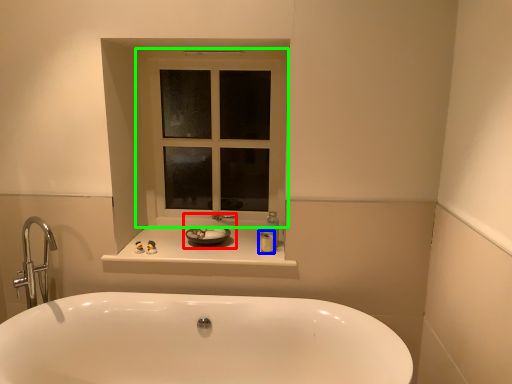
Question: Which object is positioned closest to sink (highlighted by a red box)? Select from toiletry (highlighted by a blue box) and window (highlighted by a green box).

Choices:
 (A) toiletry
 (B) window

Answer: (A)